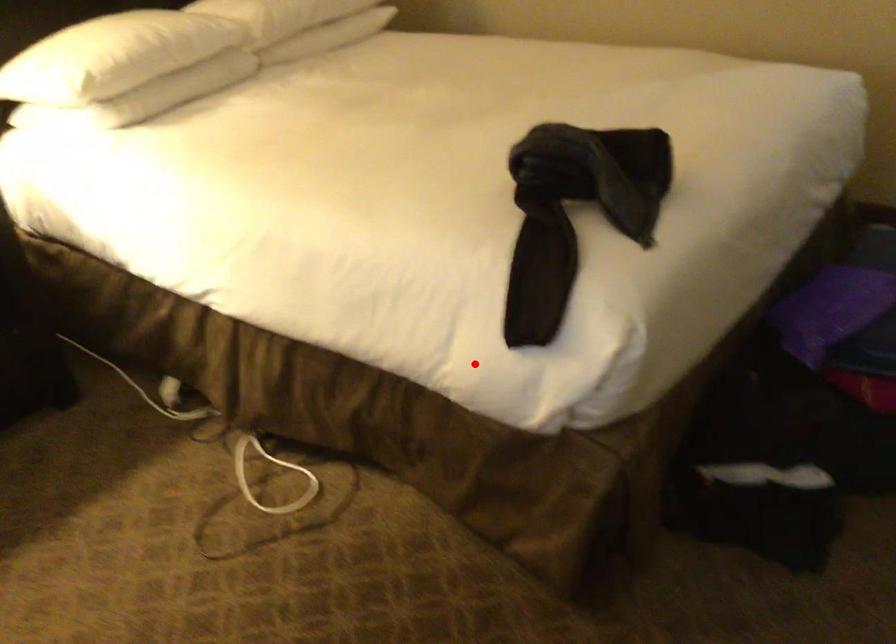
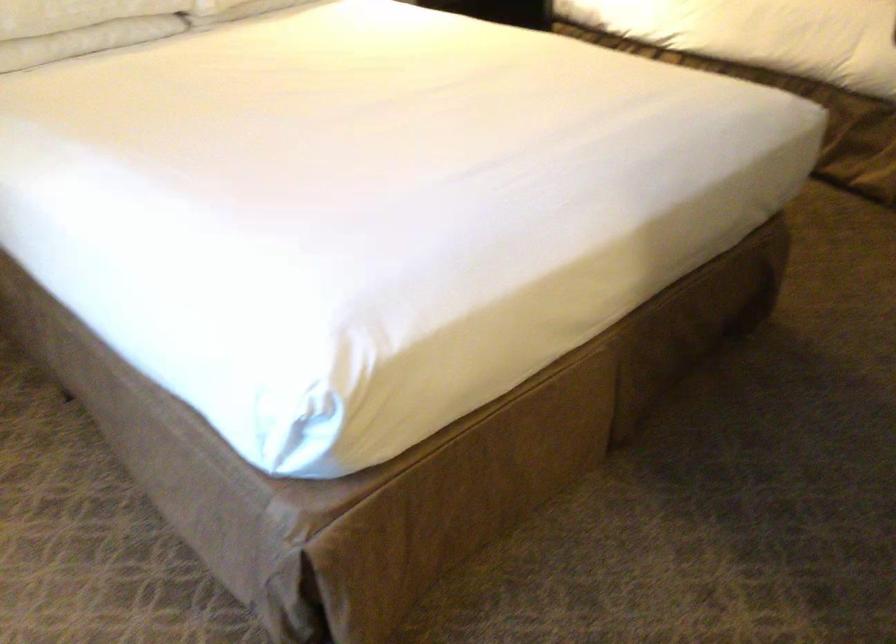
Locate, in the second image, the point that corresponds to the highlighted location in the first image.

(874, 53)